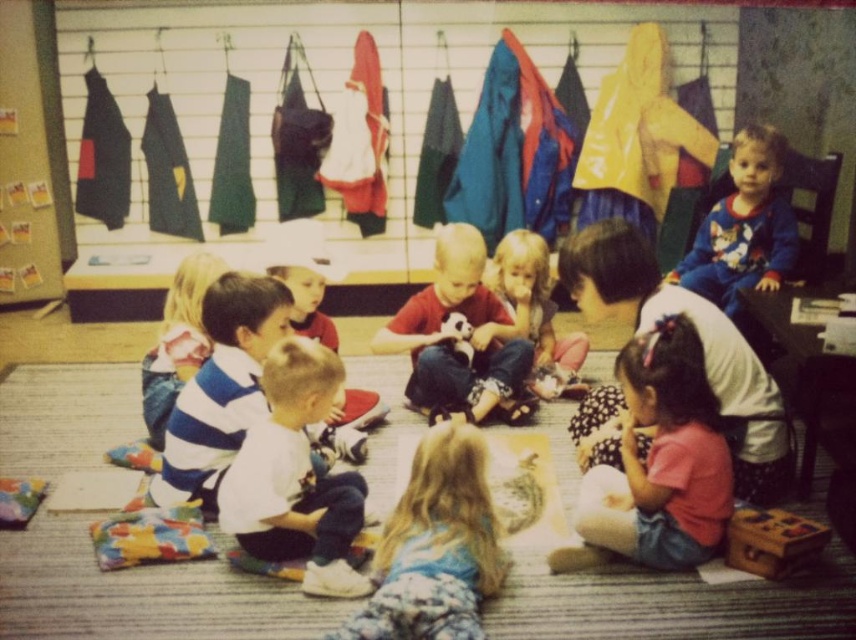
Which is behind, point (307, 362) or point (211, 429)?

The point (211, 429) is more distant.

Which is behind, point (314, 582) or point (198, 470)?

The point (198, 470) is more distant.

The height and width of the screenshot is (640, 856). I want to click on white cotton shirt at center, so click(x=295, y=476).

Consider the image. Between matte red shirt at center and wooden toy at lower right, which one has more height?

With more height is matte red shirt at center.

Is matte red shirt at center to the left of wooden toy at lower right from the viewer's perspective?

Yes, matte red shirt at center is to the left of wooden toy at lower right.

Who is more forward, (462, 243) or (742, 564)?

Point (742, 564) is more forward.

Identify the location of matte red shirt at center. (455, 337).

Does point (654, 528) lie behind point (188, 376)?

No, (654, 528) is in front of (188, 376).

Between point (593, 524) and point (177, 385), which one is positioned in front?

Point (593, 524)

Identify the location of pink cotton shirt at lower center. (658, 461).